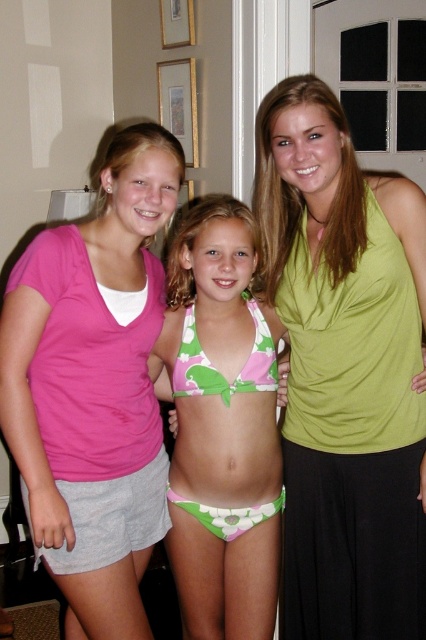
The width and height of the screenshot is (426, 640). What do you see at coordinates (221, 426) in the screenshot? I see `floral bikini bottom at center` at bounding box center [221, 426].

What do you see at coordinates (221, 426) in the screenshot? I see `floral bikini bottom at center` at bounding box center [221, 426].

Where is `floral bikini bottom at center`? The width and height of the screenshot is (426, 640). floral bikini bottom at center is located at coordinates (221, 426).

Is pink cotton t-shirt at left smaller than floral bikini bottom at center?

Incorrect, pink cotton t-shirt at left is not smaller in size than floral bikini bottom at center.

Who is positioned more to the left, pink cotton t-shirt at left or floral bikini bottom at center?

pink cotton t-shirt at left is more to the left.

Is point (68, 614) farther from viewer compared to point (230, 467)?

Yes.

Locate an element on the screen. pink cotton t-shirt at left is located at coordinates (89, 337).

Based on the photo, does green fabric tank top at upper right have a lesser width compared to floral bikini bottom at center?

No, green fabric tank top at upper right is not thinner than floral bikini bottom at center.

Find the location of a particular element. The height and width of the screenshot is (640, 426). green fabric tank top at upper right is located at coordinates (345, 371).

Does point (321, 556) lie in front of point (250, 474)?

No.

Locate an element on the screen. green fabric tank top at upper right is located at coordinates (345, 371).